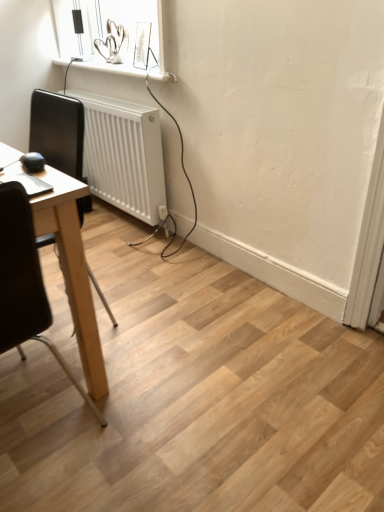
Identify the location of black leather chair at left, positioned as the first chair in front-to-back order. (25, 283).

What is the approximate width of black leather chair at left, positioned as the second chair in front-to-back order?

It is 41.59 centimeters.

Find the location of a particular element. This screenshot has width=384, height=512. black leather chair at left, positioned as the second chair in front-to-back order is located at coordinates (58, 131).

Identify the location of black leather chair at left, the second chair positioned from the back. The width and height of the screenshot is (384, 512). point(25,283).

Can you confirm if black leather chair at left, the second chair positioned from the back, is thinner than black leather chair at left, placed as the 1th chair when sorted from back to front?

No.

Is black leather chair at left, positioned as the first chair in front-to-back order, to the right of black leather chair at left, placed as the 1th chair when sorted from back to front, from the viewer's perspective?

Correct, you'll find black leather chair at left, positioned as the first chair in front-to-back order, to the right of black leather chair at left, placed as the 1th chair when sorted from back to front.

From the image's perspective, relative to black leather chair at left, placed as the 1th chair when sorted from back to front, is black leather chair at left, the second chair positioned from the back, above or below?

black leather chair at left, the second chair positioned from the back, is situated lower than black leather chair at left, placed as the 1th chair when sorted from back to front, in the image.

Considering the relative positions of black leather chair at left, placed as the 1th chair when sorted from back to front, and white plastic radiator at lower left in the image provided, is black leather chair at left, placed as the 1th chair when sorted from back to front, to the left or to the right of white plastic radiator at lower left?

black leather chair at left, placed as the 1th chair when sorted from back to front, is to the left of white plastic radiator at lower left.

Between point (68, 132) and point (125, 163), which one is positioned in front?

The point (125, 163) is in front.

How distant is black leather chair at left, placed as the 1th chair when sorted from back to front, from white plastic radiator at lower left?

black leather chair at left, placed as the 1th chair when sorted from back to front, and white plastic radiator at lower left are 12.13 inches apart from each other.

How many degrees apart are the facing directions of black leather chair at left, positioned as the second chair in front-to-back order, and white plastic radiator at lower left?

1.39 degrees separate the facing orientations of black leather chair at left, positioned as the second chair in front-to-back order, and white plastic radiator at lower left.

Is black leather chair at left, positioned as the first chair in front-to-back order, a part of white plastic radiator at lower left?

No.

Consider the image. Who is smaller, white plastic radiator at lower left or black leather chair at left, positioned as the first chair in front-to-back order?

white plastic radiator at lower left is smaller.

Is white plastic radiator at lower left not close to black leather chair at left, the second chair positioned from the back?

That's right, there is a large distance between white plastic radiator at lower left and black leather chair at left, the second chair positioned from the back.

Image resolution: width=384 pixels, height=512 pixels. In order to click on radiator behind the black leather chair at left, the second chair positioned from the back in this screenshot , I will do `click(123, 155)`.

From the image's perspective, which object appears higher, black leather chair at left, positioned as the first chair in front-to-back order, or white plastic radiator at lower left?

white plastic radiator at lower left.

Is black leather chair at left, positioned as the first chair in front-to-back order, completely or partially outside of white plastic radiator at lower left?

Yes, black leather chair at left, positioned as the first chair in front-to-back order, is not within white plastic radiator at lower left.

Locate an element on the screen. Image resolution: width=384 pixels, height=512 pixels. radiator behind the black leather chair at left, positioned as the first chair in front-to-back order is located at coordinates (123, 155).

From the image's perspective, who appears lower, white plastic radiator at lower left or black leather chair at left, positioned as the second chair in front-to-back order?

black leather chair at left, positioned as the second chair in front-to-back order, appears lower in the image.

Is white plastic radiator at lower left beside black leather chair at left, placed as the 1th chair when sorted from back to front?

No, white plastic radiator at lower left is not beside black leather chair at left, placed as the 1th chair when sorted from back to front.

How much distance is there between white plastic radiator at lower left and black leather chair at left, placed as the 1th chair when sorted from back to front?

white plastic radiator at lower left is 12.13 inches away from black leather chair at left, placed as the 1th chair when sorted from back to front.

Between white plastic radiator at lower left and black leather chair at left, positioned as the second chair in front-to-back order, which one has more height?

black leather chair at left, positioned as the second chair in front-to-back order, is taller.

Considering the sizes of black leather chair at left, placed as the 1th chair when sorted from back to front, and black leather chair at left, the second chair positioned from the back, in the image, is black leather chair at left, placed as the 1th chair when sorted from back to front, wider or thinner than black leather chair at left, the second chair positioned from the back,?

In the image, black leather chair at left, placed as the 1th chair when sorted from back to front, appears to be more narrow than black leather chair at left, the second chair positioned from the back.

From a real-world perspective, is black leather chair at left, positioned as the second chair in front-to-back order, below black leather chair at left, positioned as the first chair in front-to-back order?

Incorrect, from a real-world perspective, black leather chair at left, positioned as the second chair in front-to-back order, is higher than black leather chair at left, positioned as the first chair in front-to-back order.

Looking at this image, could you measure the distance between black leather chair at left, positioned as the second chair in front-to-back order, and black leather chair at left, positioned as the first chair in front-to-back order?

black leather chair at left, positioned as the second chair in front-to-back order, is 1.72 meters away from black leather chair at left, positioned as the first chair in front-to-back order.

Are black leather chair at left, placed as the 1th chair when sorted from back to front, and black leather chair at left, positioned as the first chair in front-to-back order, located far from each other?

Absolutely, black leather chair at left, placed as the 1th chair when sorted from back to front, is distant from black leather chair at left, positioned as the first chair in front-to-back order.

Image resolution: width=384 pixels, height=512 pixels. What are the coordinates of `chair on the right of black leather chair at left, positioned as the second chair in front-to-back order` in the screenshot? It's located at (25, 283).

In the image, there is a black leather chair at left, positioned as the second chair in front-to-back order. Identify the location of radiator above it (from the image's perspective). (123, 155).

When comparing their distances from black leather chair at left, the second chair positioned from the back, does black leather chair at left, positioned as the second chair in front-to-back order, or white plastic radiator at lower left seem closer?

Among the two, white plastic radiator at lower left is located nearer to black leather chair at left, the second chair positioned from the back.

Which object lies nearer to the anchor point white plastic radiator at lower left, black leather chair at left, positioned as the second chair in front-to-back order, or black leather chair at left, positioned as the first chair in front-to-back order?

black leather chair at left, positioned as the second chair in front-to-back order, lies closer to white plastic radiator at lower left than the other object.

Estimate the real-world distances between objects in this image. Which object is closer to black leather chair at left, positioned as the second chair in front-to-back order, black leather chair at left, the second chair positioned from the back, or white plastic radiator at lower left?

white plastic radiator at lower left is closer to black leather chair at left, positioned as the second chair in front-to-back order.

Consider the image. From the image, which object appears to be farther from black leather chair at left, positioned as the second chair in front-to-back order, white plastic radiator at lower left or black leather chair at left, positioned as the first chair in front-to-back order?

The object further to black leather chair at left, positioned as the second chair in front-to-back order, is black leather chair at left, positioned as the first chair in front-to-back order.

Based on their spatial positions, is black leather chair at left, positioned as the first chair in front-to-back order, or black leather chair at left, positioned as the second chair in front-to-back order, closer to white plastic radiator at lower left?

The object closer to white plastic radiator at lower left is black leather chair at left, positioned as the second chair in front-to-back order.

Based on their spatial positions, is white plastic radiator at lower left or black leather chair at left, placed as the 1th chair when sorted from back to front, further from black leather chair at left, the second chair positioned from the back?

black leather chair at left, placed as the 1th chair when sorted from back to front, is positioned further to the anchor black leather chair at left, the second chair positioned from the back.

Find the location of a particular element. chair between black leather chair at left, positioned as the first chair in front-to-back order, and white plastic radiator at lower left from front to back is located at coordinates (58, 131).